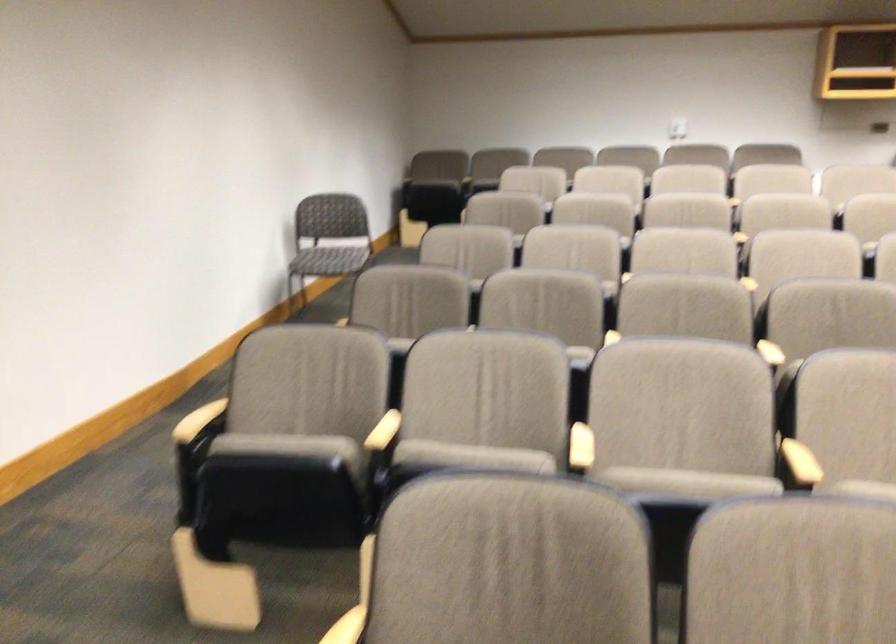
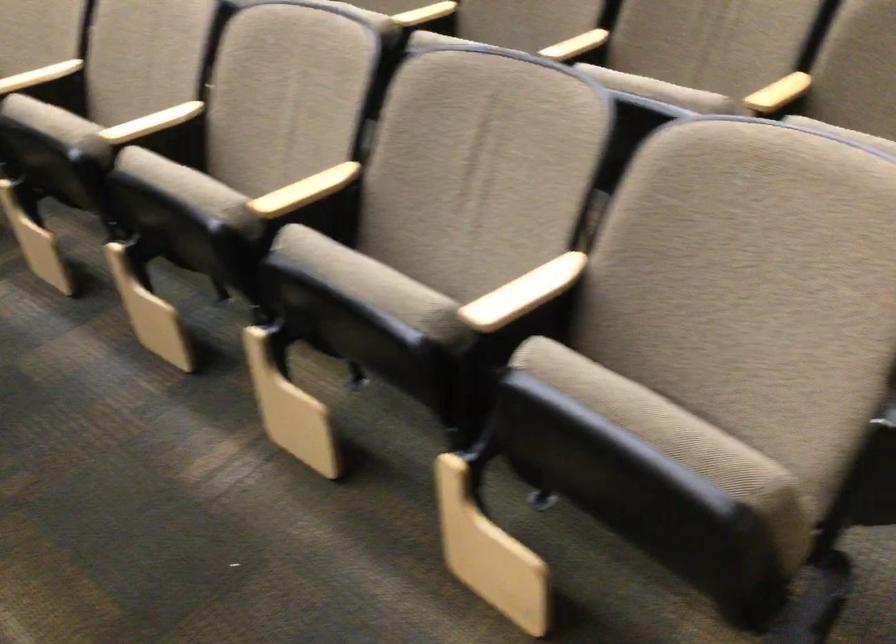
Question: Which direction would the cameraman need to move to produce the second image? Reply with the corresponding letter.

Choices:
 (A) Left
 (B) Right
 (C) Forward
 (D) Backward

Answer: (B)